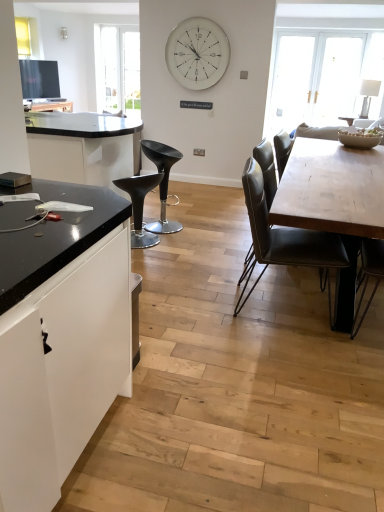
Question: Is black plastic stool at center, marked as the 1th chair in a back-to-front arrangement, facing towards matte black stool at center, placed as the third chair when sorted from right to left?

Choices:
 (A) yes
 (B) no

Answer: (B)

Question: From the image's perspective, is black plastic stool at center, the second chair viewed from the left, located above matte black stool at center, which appears as the 2th chair when viewed from the back?

Choices:
 (A) yes
 (B) no

Answer: (A)

Question: Considering the relative positions of black plastic stool at center, the second chair from the right, and matte black stool at center, the 2th chair positioned from the front, in the image provided, is black plastic stool at center, the second chair from the right, to the left of matte black stool at center, the 2th chair positioned from the front, from the viewer's perspective?

Choices:
 (A) yes
 (B) no

Answer: (B)

Question: From the image's perspective, does black plastic stool at center, marked as the 1th chair in a back-to-front arrangement, appear lower than matte black stool at center, which appears as the 2th chair when viewed from the back?

Choices:
 (A) no
 (B) yes

Answer: (A)

Question: Can you confirm if black plastic stool at center, the second chair viewed from the left, is smaller than matte black stool at center, which appears as the 2th chair when viewed from the back?

Choices:
 (A) yes
 (B) no

Answer: (B)

Question: Is black plastic stool at center, which appears as the third chair when viewed from the front, shorter than matte black stool at center, which appears as the 2th chair when viewed from the back?

Choices:
 (A) no
 (B) yes

Answer: (A)

Question: Does black plastic stool at center, the second chair from the right, have a smaller size compared to leather-like black chair at center, marked as the third chair in a left-to-right arrangement?

Choices:
 (A) yes
 (B) no

Answer: (A)

Question: Can we say black plastic stool at center, marked as the 1th chair in a back-to-front arrangement, lies outside leather-like black chair at center, marked as the third chair in a left-to-right arrangement?

Choices:
 (A) yes
 (B) no

Answer: (A)

Question: Can you confirm if black plastic stool at center, the second chair viewed from the left, is shorter than leather-like black chair at center, marked as the third chair in a left-to-right arrangement?

Choices:
 (A) yes
 (B) no

Answer: (A)

Question: Is black plastic stool at center, the second chair viewed from the left, wider than leather-like black chair at center, which appears as the first chair when viewed from the front?

Choices:
 (A) yes
 (B) no

Answer: (B)

Question: Is black plastic stool at center, the second chair from the right, closer to camera compared to leather-like black chair at center, which appears as the first chair when viewed from the front?

Choices:
 (A) no
 (B) yes

Answer: (A)

Question: Considering the relative positions of black plastic stool at center, marked as the 1th chair in a back-to-front arrangement, and leather-like black chair at center, marked as the third chair in a left-to-right arrangement, in the image provided, is black plastic stool at center, marked as the 1th chair in a back-to-front arrangement, to the left of leather-like black chair at center, marked as the third chair in a left-to-right arrangement, from the viewer's perspective?

Choices:
 (A) yes
 (B) no

Answer: (A)

Question: Considering the relative sizes of black plastic stool at center, the second chair viewed from the left, and wooden table at center in the image provided, is black plastic stool at center, the second chair viewed from the left, smaller than wooden table at center?

Choices:
 (A) no
 (B) yes

Answer: (B)